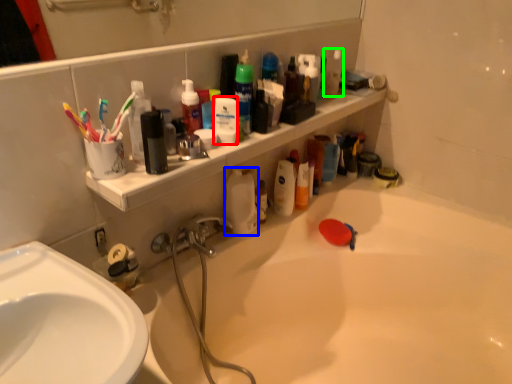
Question: Based on their relative distances, which object is farther from cleaning product (highlighted by a red box)? Choose from cleaning product (highlighted by a blue box) and cleaning product (highlighted by a green box).

Choices:
 (A) cleaning product
 (B) cleaning product

Answer: (B)